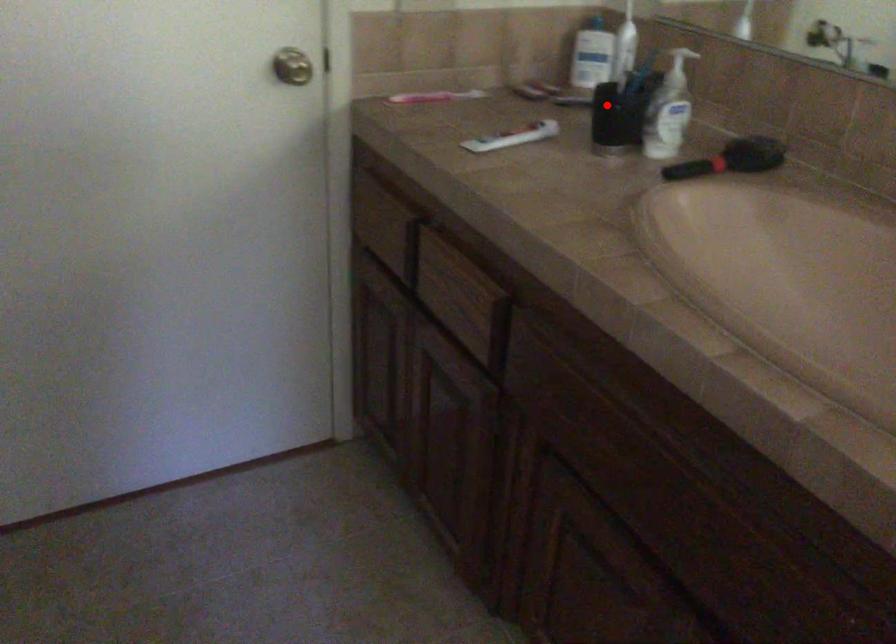
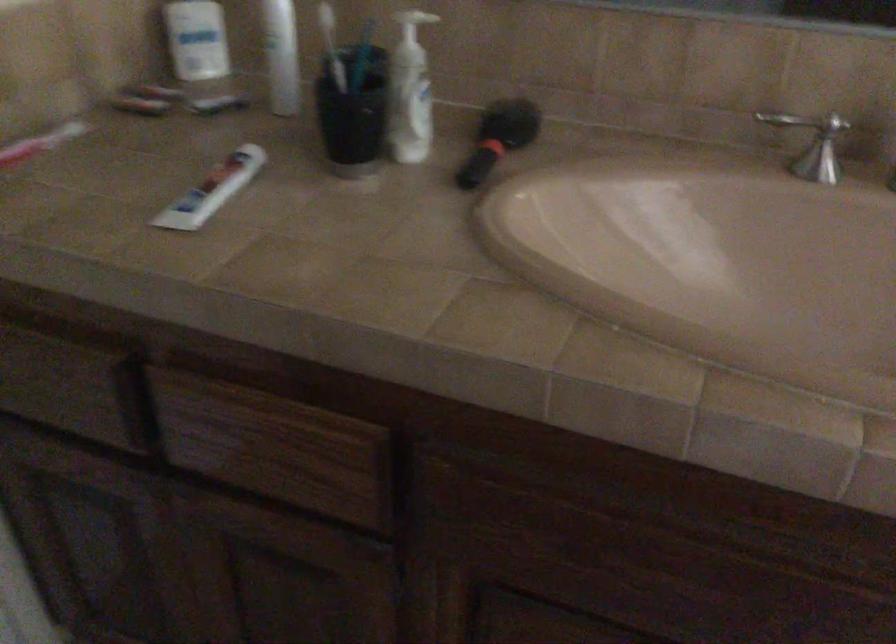
Question: I am providing you with two images of the same scene from different viewpoints. In image1, a red point is highlighted. Considering the same 3D point in image2, which of the following is correct?

Choices:
 (A) It is closer
 (B) It is farther

Answer: (A)